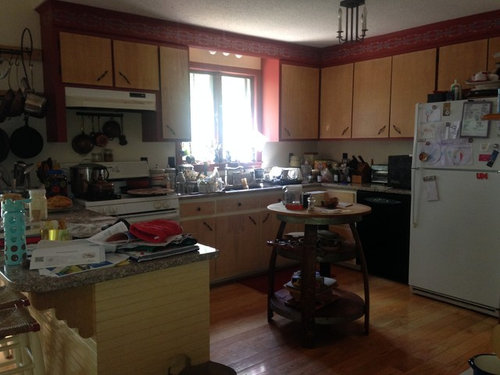
Where is `floor`? The width and height of the screenshot is (500, 375). floor is located at coordinates (403, 343).